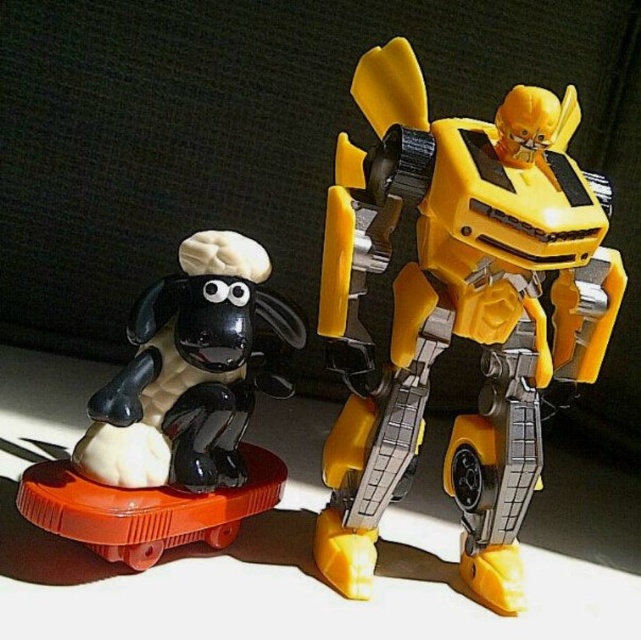
Does yellow plastic robot at upper right come in front of black glossy sheep at left?

That is False.

Is yellow plastic robot at upper right shorter than black glossy sheep at left?

Incorrect, yellow plastic robot at upper right's height does not fall short of black glossy sheep at left's.

Does point (462, 260) come in front of point (163, 332)?

Yes, it is in front of point (163, 332).

Locate an element on the screen. Image resolution: width=641 pixels, height=640 pixels. yellow plastic robot at upper right is located at coordinates (458, 308).